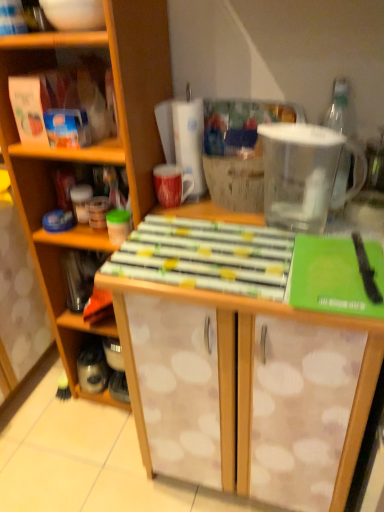
The height and width of the screenshot is (512, 384). What are the coordinates of `vacant space in front of white dotted wood cabinet at center` in the screenshot? It's located at (92, 457).